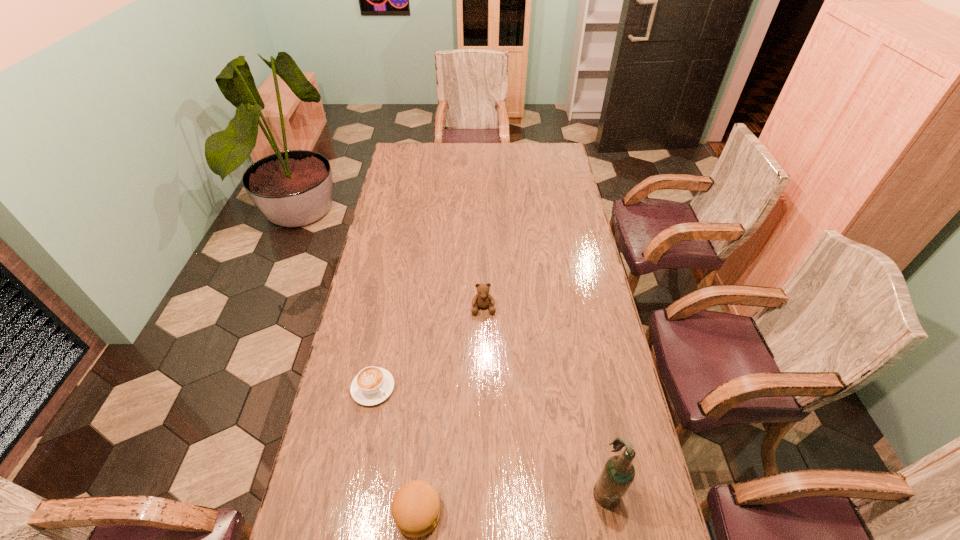
The height and width of the screenshot is (540, 960). I want to click on vacant space located 0.100m on the side of the cappuccino with the handle, so click(409, 421).

The width and height of the screenshot is (960, 540). Find the location of `vacant position located 0.110m on the side of the cappuccino with the handle`. vacant position located 0.110m on the side of the cappuccino with the handle is located at coordinates (411, 423).

Find the location of a particular element. This screenshot has width=960, height=540. free location located on the side of the cappuccino with the handle is located at coordinates (474, 482).

The image size is (960, 540). Identify the location of blank space located 0.110m on the front-facing side of the third shortest object. (486, 342).

Locate an element on the screen. free space located on the front-facing side of the third shortest object is located at coordinates (491, 419).

Find the location of a particular element. vacant position located on the front-facing side of the third shortest object is located at coordinates (485, 328).

Find the location of a particular element. This screenshot has width=960, height=540. hamburger present at the near edge is located at coordinates (416, 508).

I want to click on beer bottle present at the near edge, so click(618, 473).

I want to click on object present at the left edge, so click(x=372, y=385).

Locate an element on the screen. object located in the right edge section of the desktop is located at coordinates (618, 473).